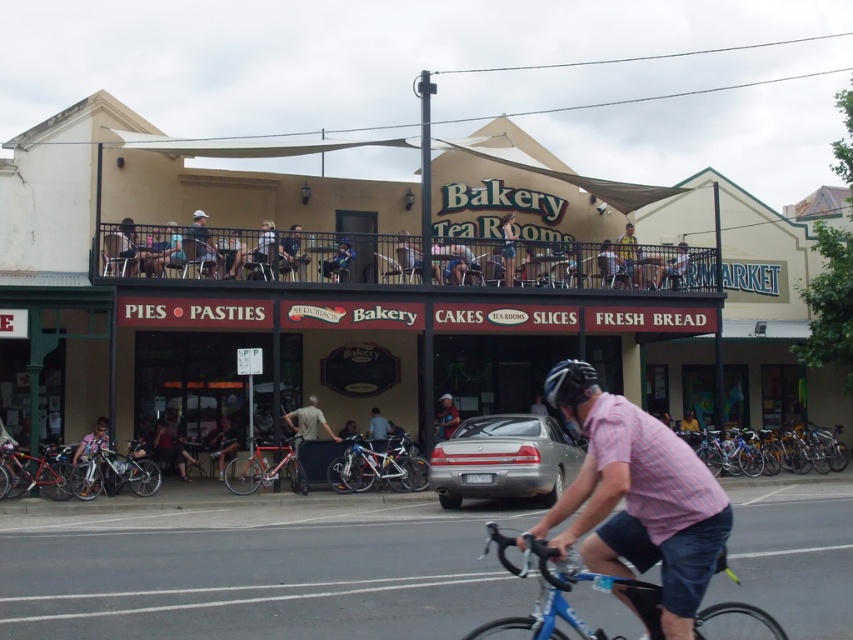
Question: Which of the following is the farthest from the observer?

Choices:
 (A) (503, 243)
 (B) (633, 256)

Answer: (B)

Question: Among these objects, which one is farthest from the camera?

Choices:
 (A) blue metallic bicycle at lower right
 (B) yellow fabric shirt at upper center
 (C) shiny metallic bicycle at lower left

Answer: (B)

Question: Which of the following is the farthest from the observer?

Choices:
 (A) dark gray helmet at upper center
 (B) blue metallic bicycle at lower right
 (C) matte black helmet at upper center
 (D) metallic bicycle at lower left

Answer: (A)

Question: Does shiny red bicycle at center have a smaller size compared to metallic bicycle at lower left?

Choices:
 (A) yes
 (B) no

Answer: (B)

Question: Is yellow fabric shirt at upper center above light blue helmet at upper center?

Choices:
 (A) no
 (B) yes

Answer: (B)

Question: Does blue metallic bicycle at lower right come in front of yellow fabric shirt at upper center?

Choices:
 (A) yes
 (B) no

Answer: (A)